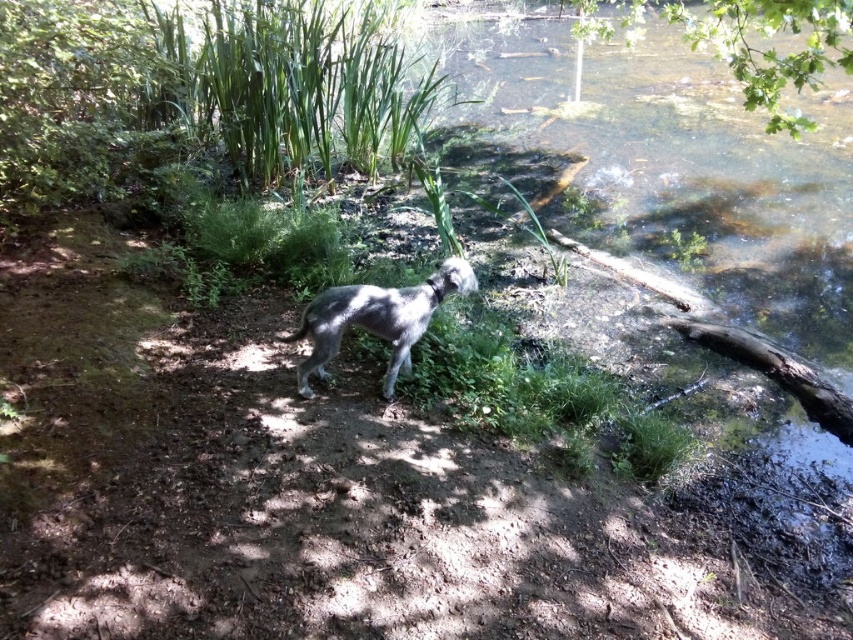
Is green leafy tree at upper right wider than fuzzy gray dog at center?

Yes.

Can you confirm if green leafy tree at upper right is shorter than fuzzy gray dog at center?

No, green leafy tree at upper right is not shorter than fuzzy gray dog at center.

Does point (737, 58) come behind point (386, 376)?

Yes, point (737, 58) is behind point (386, 376).

Image resolution: width=853 pixels, height=640 pixels. In order to click on green leafy tree at upper right in this screenshot , I will do `click(749, 42)`.